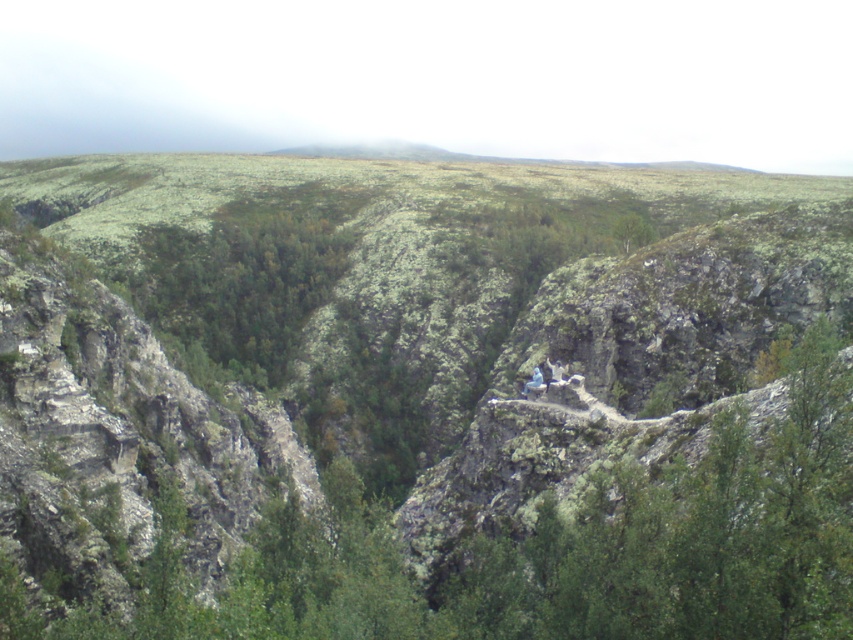
Question: Does green leafy tree at upper center come behind green mossy trees at center?

Choices:
 (A) no
 (B) yes

Answer: (A)

Question: Does green mossy trees at center appear over blue fabric person at center?

Choices:
 (A) no
 (B) yes

Answer: (B)

Question: Considering the real-world distances, which object is farthest from the green mossy trees at center?

Choices:
 (A) green leafy tree at upper center
 (B) blue fabric person at center

Answer: (B)

Question: Among these points, which one is nearest to the camera?

Choices:
 (A) (175, 504)
 (B) (189, 243)

Answer: (A)

Question: Which point is farther to the camera?

Choices:
 (A) (228, 221)
 (B) (538, 376)
 (C) (387, 554)

Answer: (A)

Question: Can you confirm if green mossy trees at center is positioned to the right of blue fabric person at center?

Choices:
 (A) no
 (B) yes

Answer: (A)